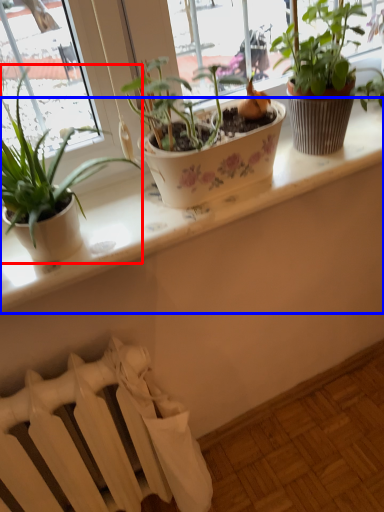
Question: Which of the following is the farthest to the observer, houseplant (highlighted by a red box) or window sill (highlighted by a blue box)?

Choices:
 (A) houseplant
 (B) window sill

Answer: (B)